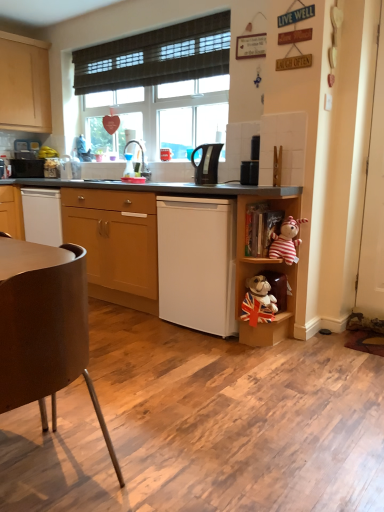
In order to click on vacant region in front of white matte dishwasher at center in this screenshot , I will do click(213, 350).